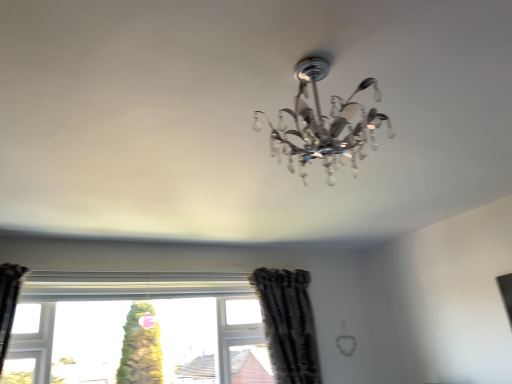
Question: In terms of width, does clear glass window at center look wider or thinner when compared to black textured curtain at lower center?

Choices:
 (A) wide
 (B) thin

Answer: (B)

Question: Is clear glass window at center taller or shorter than black textured curtain at lower center?

Choices:
 (A) short
 (B) tall

Answer: (A)

Question: Based on their positions, is clear glass window at center located to the left or right of black textured curtain at lower center?

Choices:
 (A) right
 (B) left

Answer: (B)

Question: Relative to clear glass window at center, is black textured curtain at lower center in front or behind?

Choices:
 (A) front
 (B) behind

Answer: (B)

Question: Would you say black textured curtain at lower center is to the left or to the right of clear glass window at center in the picture?

Choices:
 (A) left
 (B) right

Answer: (B)

Question: From a real-world perspective, is black textured curtain at lower center above or below clear glass window at center?

Choices:
 (A) above
 (B) below

Answer: (A)

Question: Looking at their shapes, would you say black textured curtain at lower center is wider or thinner than clear glass window at center?

Choices:
 (A) thin
 (B) wide

Answer: (B)